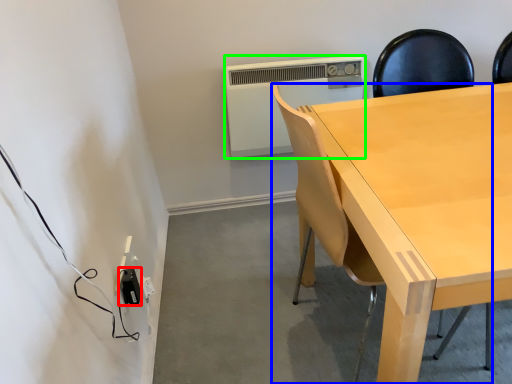
Question: Estimate the real-world distances between objects in this image. Which object is farther from electric outlet (highlighted by a red box), chair (highlighted by a blue box) or air conditioning (highlighted by a green box)?

Choices:
 (A) chair
 (B) air conditioning

Answer: (B)